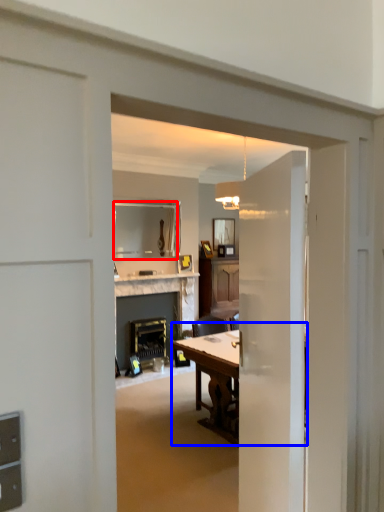
Question: Which object is further to the camera taking this photo, mirror (highlighted by a red box) or table (highlighted by a blue box)?

Choices:
 (A) mirror
 (B) table

Answer: (A)